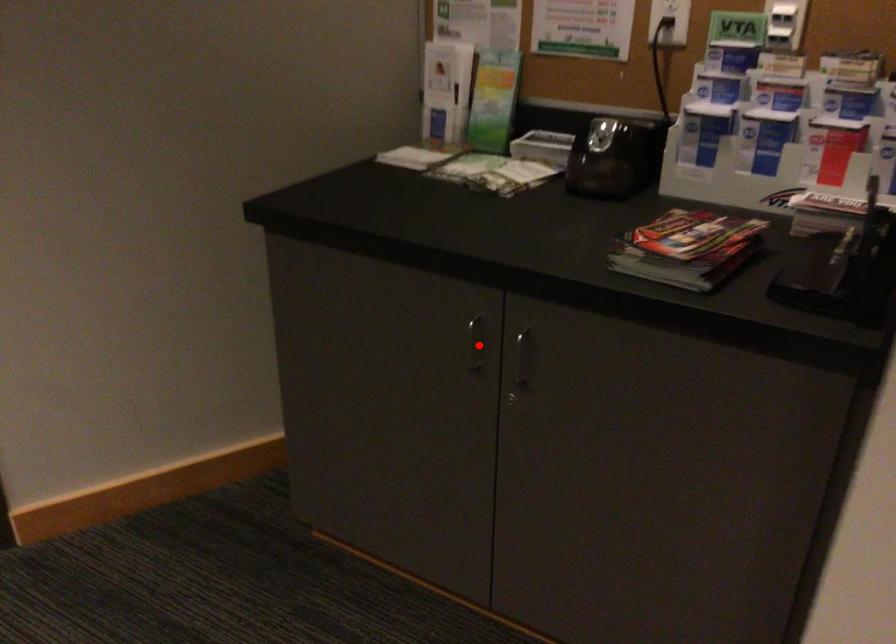
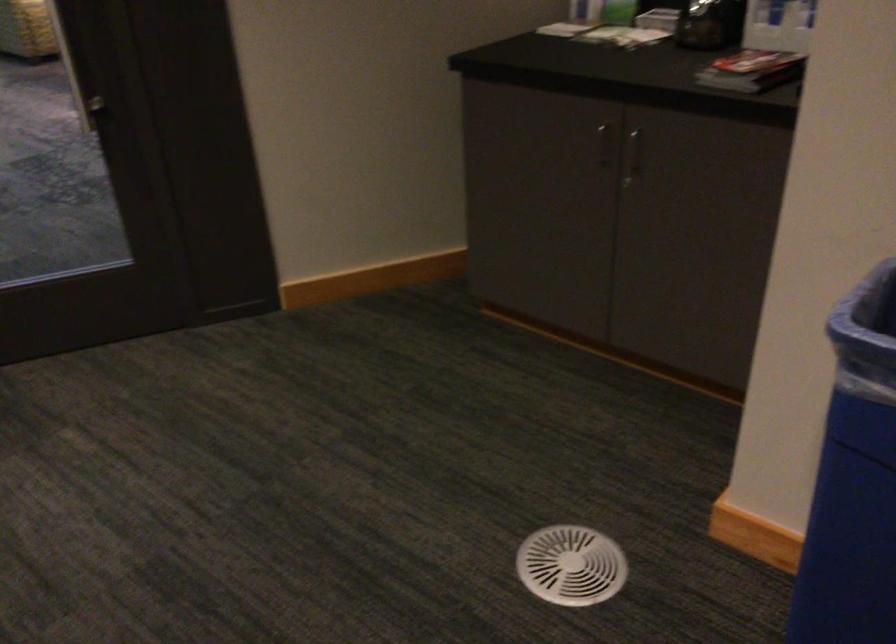
Question: I am providing you with two images of the same scene from different viewpoints. Given a red point in image1, look at the same physical point in image2. Is it:

Choices:
 (A) Closer to the viewpoint
 (B) Farther from the viewpoint

Answer: (B)